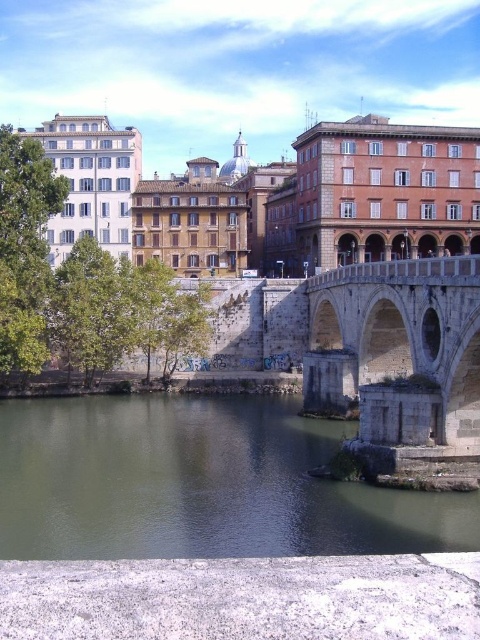
You are standing on the riverbank and want to take a photo of the stone arch bridge at center. However, there is greenish water at lower left in the foreground. Will the water block your view of the bridge?

The greenish water at lower left is closer to the viewer than the stone arch bridge at center, so it will block the view of the bridge.

You are an architect analyzing the urban layout of this area. You need to determine which object occupies a bigger area in the image between the greenish water at lower left and the stone arch bridge at center. Which one is larger?

The greenish water at lower left is larger in size than the stone arch bridge at center, so the greenish water at lower left occupies a bigger area in the image.